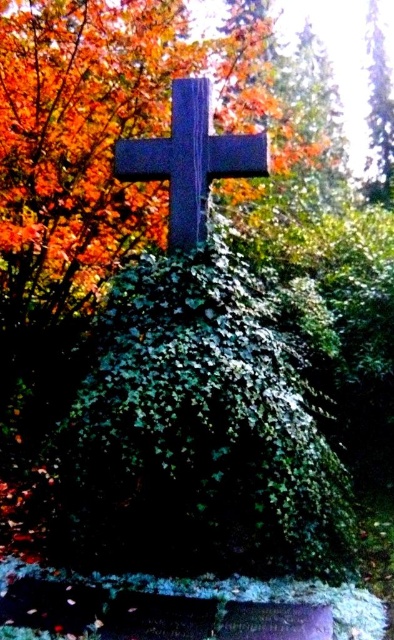
This screenshot has width=394, height=640. What do you see at coordinates (198, 432) in the screenshot? I see `green leafy bush at center` at bounding box center [198, 432].

Between green leafy bush at center and dark gray stone cross at center, which one has more height?

green leafy bush at center is taller.

Which is behind, point (197, 356) or point (170, 211)?

Positioned behind is point (170, 211).

Where is `green leafy bush at center`? green leafy bush at center is located at coordinates (198, 432).

Is green leafy bush at center thinner than green leafy tree at upper right?

No, green leafy bush at center is not thinner than green leafy tree at upper right.

In the scene shown: Is green leafy bush at center bigger than green leafy tree at upper right?

Yes, green leafy bush at center is bigger than green leafy tree at upper right.

Who is more distant from viewer, (139, 449) or (371, 163)?

Point (371, 163)

Image resolution: width=394 pixels, height=640 pixels. I want to click on green leafy bush at center, so click(x=198, y=432).

Is dark gray stone cross at center positioned behind green leafy tree at upper right?

That is False.

Which is in front, point (124, 145) or point (366, 28)?

Positioned in front is point (124, 145).

In order to click on dark gray stone cross at center in this screenshot , I will do `click(191, 161)`.